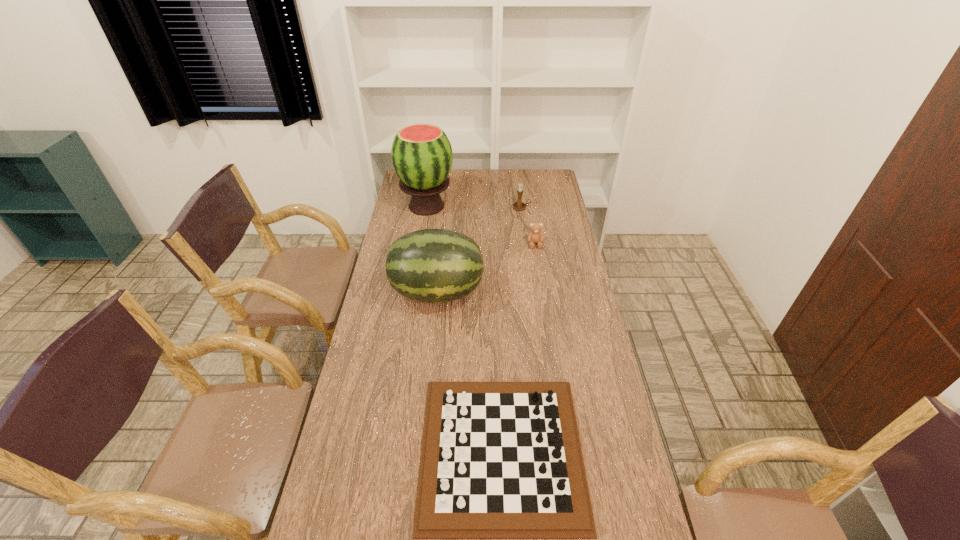
You are a GUI agent. You are given a task and a screenshot of the screen. Output one action in this format:
    pyautogui.click(x=<x>, y=<y>)
    Task: Click on the farther watermelon
    The width and height of the screenshot is (960, 540).
    Given the screenshot: What is the action you would take?
    pyautogui.click(x=421, y=154)

The height and width of the screenshot is (540, 960). What are the coordinates of `the tallest object` in the screenshot? It's located at (421, 154).

The image size is (960, 540). Find the location of `the shorter watermelon`. the shorter watermelon is located at coordinates (431, 265).

Identify the location of the second nearest object. (431, 265).

You are a GUI agent. You are given a task and a screenshot of the screen. Output one action in this format:
    pyautogui.click(x=<x>, y=<y>)
    Task: Click on the candle holder
    
    Given the screenshot: What is the action you would take?
    pyautogui.click(x=519, y=205)

This screenshot has height=540, width=960. I want to click on the third farthest object, so click(535, 236).

At what (x,y) coordinates should I click in order to perform the action: click on teddy bear. Please return your answer as a coordinate pair (x, y). The width and height of the screenshot is (960, 540). Looking at the image, I should click on (535, 236).

Find the location of a particular element. gameboard is located at coordinates (500, 460).

Where is `the shortest object`? the shortest object is located at coordinates (500, 460).

Locate an element on the screen. vacant region located 0.070m on the right of the tallest object is located at coordinates (468, 206).